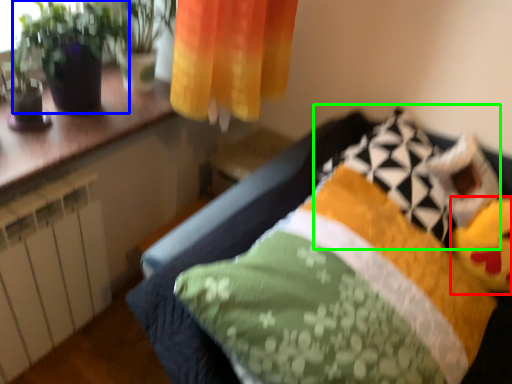
Question: Which object is the farthest from toy (highlighted by a red box)? Choose among these: houseplant (highlighted by a blue box) or pillow (highlighted by a green box).

Choices:
 (A) houseplant
 (B) pillow

Answer: (A)